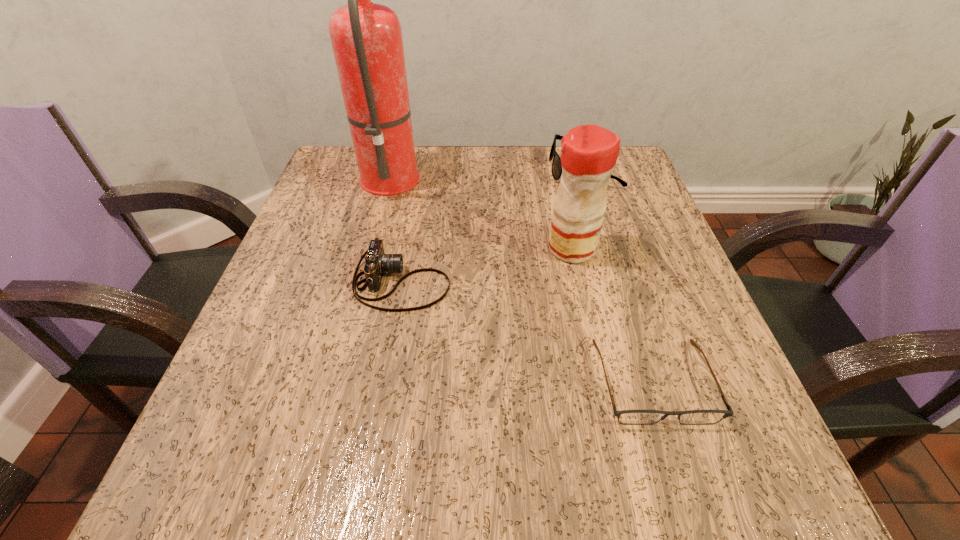
You are a GUI agent. You are given a task and a screenshot of the screen. Output one action in this format:
    pyautogui.click(x=<x>, y=<y>)
    Task: Click on the object at the far left corner
    
    Given the screenshot: What is the action you would take?
    pyautogui.click(x=366, y=37)

I want to click on object present at the far right corner, so click(x=556, y=169).

I want to click on vacant space at the far edge, so click(x=464, y=169).

Locate an element on the screen. free space at the left edge is located at coordinates (329, 307).

Where is `vacant space at the right edge of the desktop`? This screenshot has width=960, height=540. vacant space at the right edge of the desktop is located at coordinates (665, 268).

Find the location of `vacant space at the far left corner`. vacant space at the far left corner is located at coordinates (332, 173).

I want to click on free space at the near left corner of the desktop, so click(x=185, y=487).

Identify the location of vacant space at the near right corner of the desktop. (705, 500).

Locate an element on the screen. free space between the sunglasses and the tallest object is located at coordinates (488, 173).

Find the location of a particular element. vacant area that lies between the sunglasses and the camera is located at coordinates (493, 227).